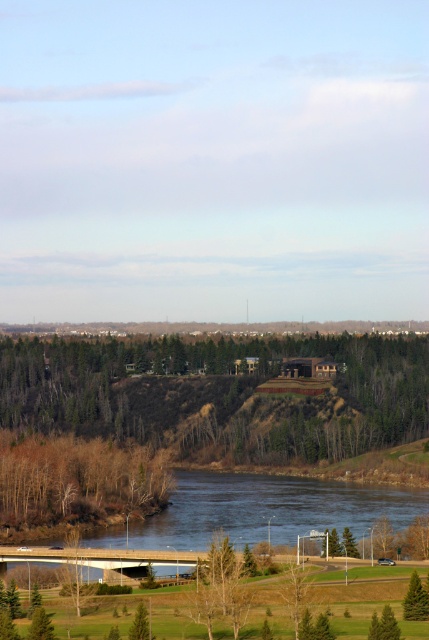
You are standing at point (215, 394) in the image. What object is directly in front of you?

The green leafy tree at center is directly in front of you at point (215, 394).

You are a hiker standing at the edge of the green grassy field at lower center and want to reach the green matte tree at lower right. Which direction should you walk to get closer to the tree?

The green grassy field at lower center is wider than the green matte tree at lower right, so you should walk towards the right side of the field to approach the tree.